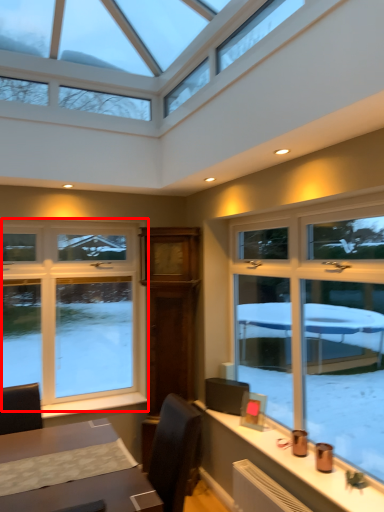
Question: From the image's perspective, where is window (annotated by the red box) located in relation to window sill in the image?

Choices:
 (A) below
 (B) above

Answer: (B)